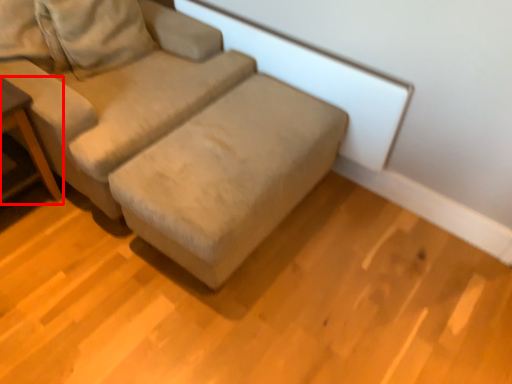
Question: From the image's perspective, considering the relative positions of table (annotated by the red box) and studio couch in the image provided, where is table (annotated by the red box) located with respect to the staircase?

Choices:
 (A) below
 (B) above

Answer: (A)